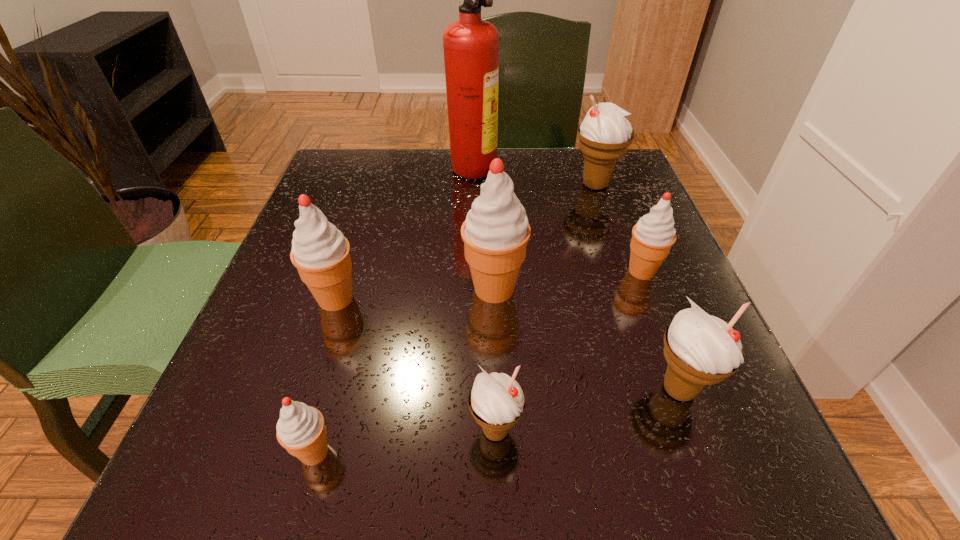
The width and height of the screenshot is (960, 540). Find the location of `the smallest white icecream`. the smallest white icecream is located at coordinates (497, 401).

Locate an element on the screen. vacant point located on the front-facing side of the red fire extinguisher is located at coordinates (596, 166).

The image size is (960, 540). Identify the location of vacant space situated on the right of the third red icecream from left to right. (594, 289).

Find the location of a particular element. The width and height of the screenshot is (960, 540). vacant area situated on the front of the biggest white icecream is located at coordinates (617, 249).

The width and height of the screenshot is (960, 540). What are the coordinates of `vacant space located on the right of the third smallest red icecream` in the screenshot? It's located at (580, 299).

I want to click on free space located on the left of the third biggest red icecream, so click(x=489, y=271).

In order to click on free region located on the left of the second smallest white icecream in this screenshot , I will do `click(483, 389)`.

Where is `free point located on the right of the nearest red icecream`? The image size is (960, 540). free point located on the right of the nearest red icecream is located at coordinates (564, 453).

I want to click on vacant space located on the right of the smallest white icecream, so click(697, 430).

This screenshot has width=960, height=540. I want to click on fire extinguisher that is at the far edge, so click(x=471, y=45).